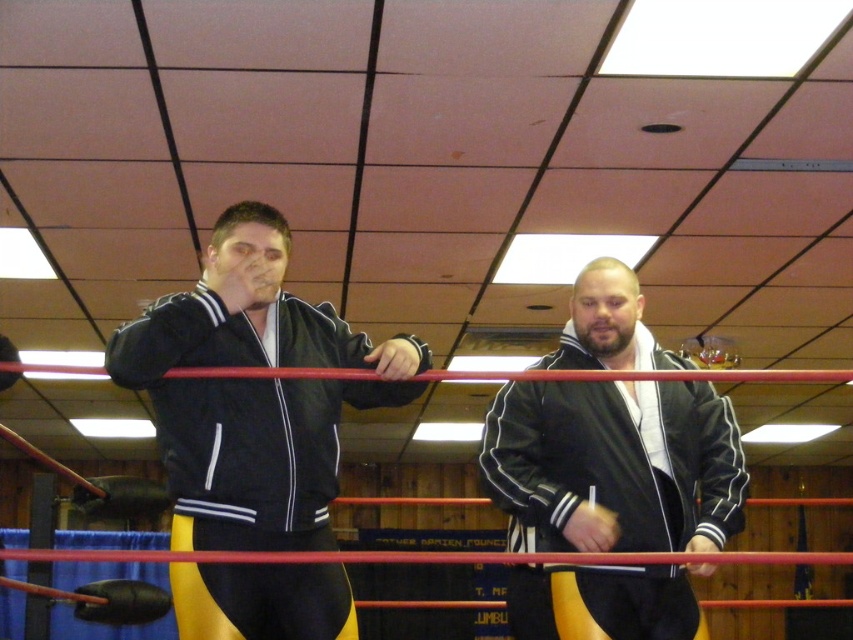
Question: Which object is closer to the camera taking this photo?

Choices:
 (A) black leather boxing glove at left
 (B) matte black jacket at center
 (C) black leather jacket at center

Answer: (B)

Question: Is matte black jacket at center smaller than black leather boxing glove at left?

Choices:
 (A) no
 (B) yes

Answer: (A)

Question: Among these points, which one is nearest to the camera?

Choices:
 (A) (697, 506)
 (B) (4, 355)
 (C) (320, 525)

Answer: (B)

Question: Can you confirm if black leather jacket at center is smaller than black leather boxing glove at left?

Choices:
 (A) yes
 (B) no

Answer: (B)

Question: Among these points, which one is farthest from the camera?

Choices:
 (A) (633, 593)
 (B) (6, 353)
 (C) (207, 289)

Answer: (A)

Question: Is matte black jacket at center further to the viewer compared to black leather boxing glove at left?

Choices:
 (A) no
 (B) yes

Answer: (A)